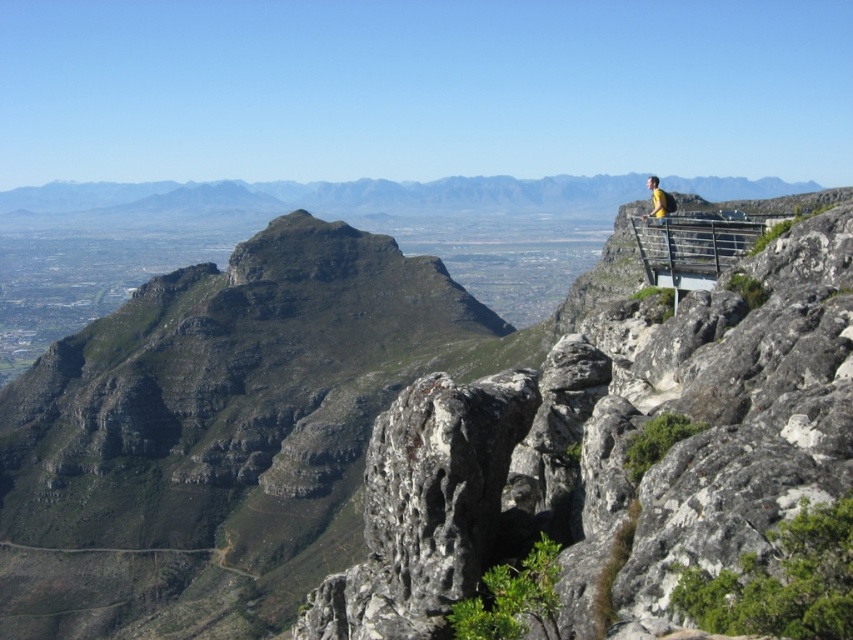
Is point (648, 253) positioned in front of point (653, 182)?

Yes.

Between metallic gray rail at upper right and yellow fabric at upper right, which one appears on the left side from the viewer's perspective?

From the viewer's perspective, metallic gray rail at upper right appears more on the left side.

Measure the distance between point (714,276) and camera.

Point (714,276) is 50.75 meters away from camera.

Where is `metallic gray rail at upper right`? metallic gray rail at upper right is located at coordinates coord(691,248).

Does rugged rock formation at upper center lie behind yellow fabric at upper right?

No, it is in front of yellow fabric at upper right.

Does rugged rock formation at upper center appear on the left side of yellow fabric at upper right?

Correct, you'll find rugged rock formation at upper center to the left of yellow fabric at upper right.

Where is `rugged rock formation at upper center`? The width and height of the screenshot is (853, 640). rugged rock formation at upper center is located at coordinates (410, 435).

Locate an element on the screen. The height and width of the screenshot is (640, 853). rugged rock formation at upper center is located at coordinates coord(410,435).

Between point (822, 458) and point (718, 269), which one is positioned in front?

Point (822, 458) is in front.

Find the location of a particular element. rugged rock formation at upper center is located at coordinates (410, 435).